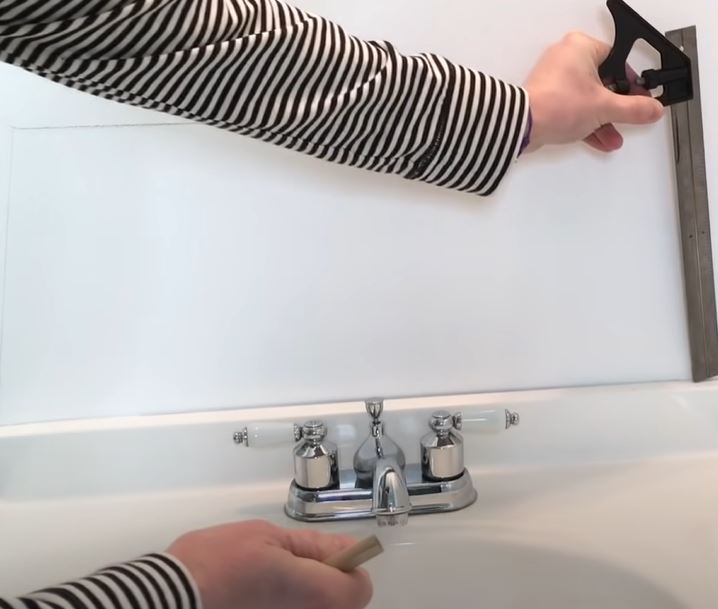
Locate an element on the screen. handle is located at coordinates (281, 435), (485, 421).